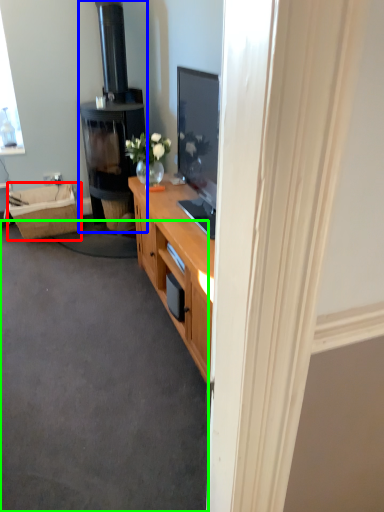
Question: Based on their relative distances, which object is farther from picnic basket (highlighted by a red box)? Choose from fireplace (highlighted by a blue box) and plain (highlighted by a green box).

Choices:
 (A) fireplace
 (B) plain

Answer: (B)